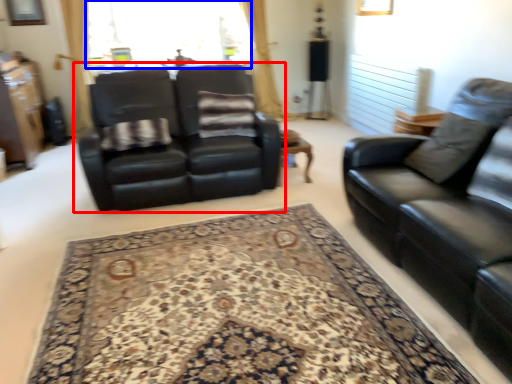
Question: Which of the following is the farthest to the observer, studio couch (highlighted by a red box) or window screen (highlighted by a blue box)?

Choices:
 (A) studio couch
 (B) window screen

Answer: (B)